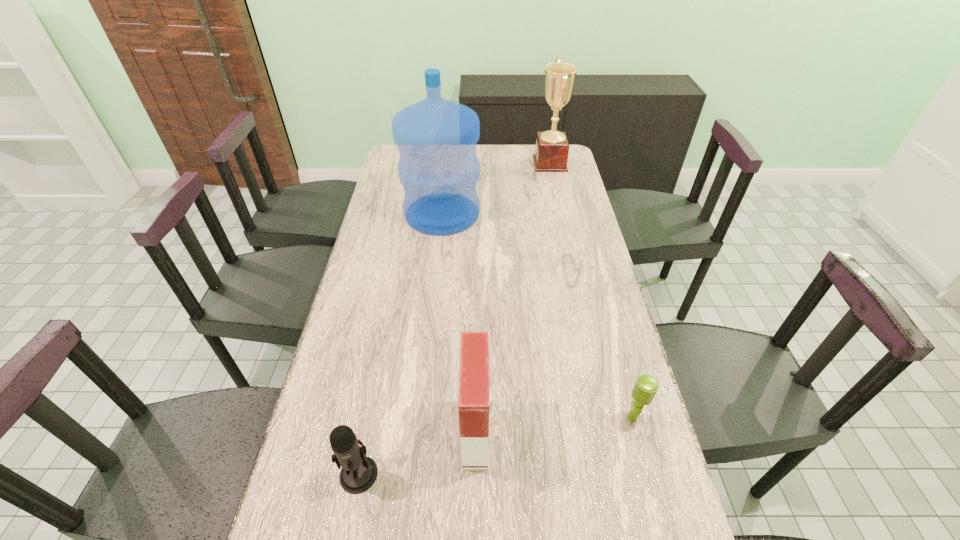
Where is `microphone situated at the right edge`? microphone situated at the right edge is located at coordinates (646, 386).

The height and width of the screenshot is (540, 960). I want to click on object that is at the far right corner, so click(552, 148).

In the image, there is a desktop. Find the location of `vacant region at the far edge`. vacant region at the far edge is located at coordinates (530, 152).

Identify the location of vacant area at the left edge. (401, 269).

Where is `free space at the right edge`? This screenshot has height=540, width=960. free space at the right edge is located at coordinates (557, 179).

At what (x,y) coordinates should I click in order to perform the action: click on vacant area that lies between the farthest object and the second shortest object. Please return your answer as a coordinate pair (x, y). The image size is (960, 540). Looking at the image, I should click on (454, 319).

This screenshot has height=540, width=960. What are the coordinates of `free space between the tallest object and the nearer microphone` in the screenshot? It's located at (400, 343).

Where is `free area in between the nearer microphone and the second farthest object`? The height and width of the screenshot is (540, 960). free area in between the nearer microphone and the second farthest object is located at coordinates (400, 343).

This screenshot has height=540, width=960. Identify the location of vacant point located between the farthest object and the water jug. (496, 188).

Image resolution: width=960 pixels, height=540 pixels. In order to click on blank region between the right microphone and the farthest object in this screenshot , I will do `click(591, 291)`.